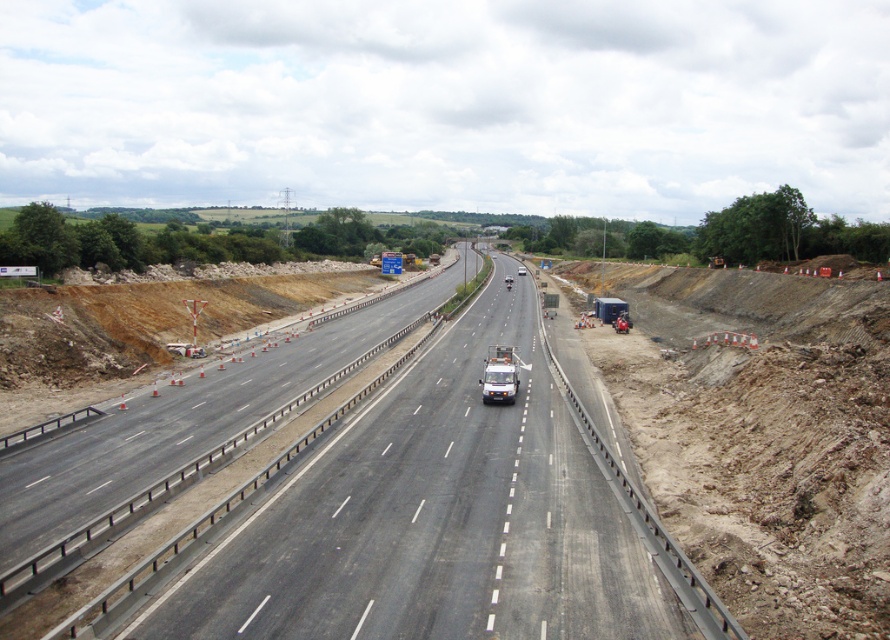
Is asphalt road at center bigger than matte black trailer truck at center?

Yes, asphalt road at center is bigger than matte black trailer truck at center.

Is point (379, 604) more distant than point (595, 307)?

No, it is in front of (595, 307).

Between point (393, 486) and point (613, 317), which one is positioned behind?

The point (613, 317) is more distant.

Where is `asphalt road at center`? The width and height of the screenshot is (890, 640). asphalt road at center is located at coordinates pos(451,518).